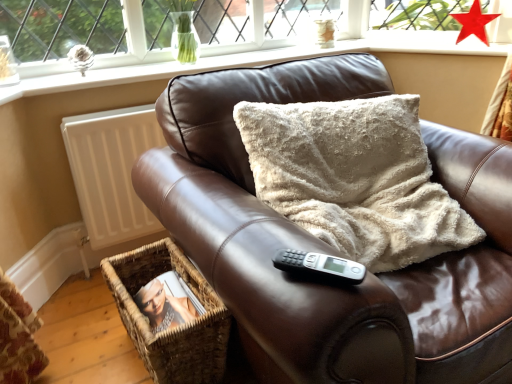
Question: Is brown leather couch at center looking in the opposite direction of smooth white surface at upper center?

Choices:
 (A) no
 (B) yes

Answer: (B)

Question: Considering the relative sizes of brown leather couch at center and smooth white surface at upper center in the image provided, is brown leather couch at center shorter than smooth white surface at upper center?

Choices:
 (A) yes
 (B) no

Answer: (B)

Question: Considering the relative positions of brown leather couch at center and smooth white surface at upper center in the image provided, is brown leather couch at center in front of smooth white surface at upper center?

Choices:
 (A) yes
 (B) no

Answer: (A)

Question: From a real-world perspective, is brown leather couch at center on top of smooth white surface at upper center?

Choices:
 (A) no
 (B) yes

Answer: (A)

Question: Considering the relative sizes of brown leather couch at center and smooth white surface at upper center in the image provided, is brown leather couch at center wider than smooth white surface at upper center?

Choices:
 (A) no
 (B) yes

Answer: (B)

Question: Is woven brown basket at lower left wider or thinner than white matte radiator at left?

Choices:
 (A) wide
 (B) thin

Answer: (A)

Question: Considering the positions of point (170, 332) and point (92, 185), is point (170, 332) closer or farther from the camera than point (92, 185)?

Choices:
 (A) closer
 (B) farther

Answer: (A)

Question: Considering their positions, is woven brown basket at lower left located in front of or behind white matte radiator at left?

Choices:
 (A) front
 (B) behind

Answer: (A)

Question: From the image's perspective, is woven brown basket at lower left above or below white matte radiator at left?

Choices:
 (A) below
 (B) above

Answer: (A)

Question: Considering the positions of white matte radiator at left and brown leather couch at center in the image, is white matte radiator at left bigger or smaller than brown leather couch at center?

Choices:
 (A) small
 (B) big

Answer: (A)

Question: From a real-world perspective, relative to brown leather couch at center, is white matte radiator at left vertically above or below?

Choices:
 (A) above
 (B) below

Answer: (B)

Question: Choose the correct answer: Is white matte radiator at left inside brown leather couch at center or outside it?

Choices:
 (A) outside
 (B) inside

Answer: (A)

Question: Is white matte radiator at left wider or thinner than brown leather couch at center?

Choices:
 (A) wide
 (B) thin

Answer: (B)

Question: In terms of height, does smooth white surface at upper center look taller or shorter compared to brown leather couch at center?

Choices:
 (A) tall
 (B) short

Answer: (B)

Question: Is smooth white surface at upper center inside or outside of brown leather couch at center?

Choices:
 (A) outside
 (B) inside

Answer: (A)